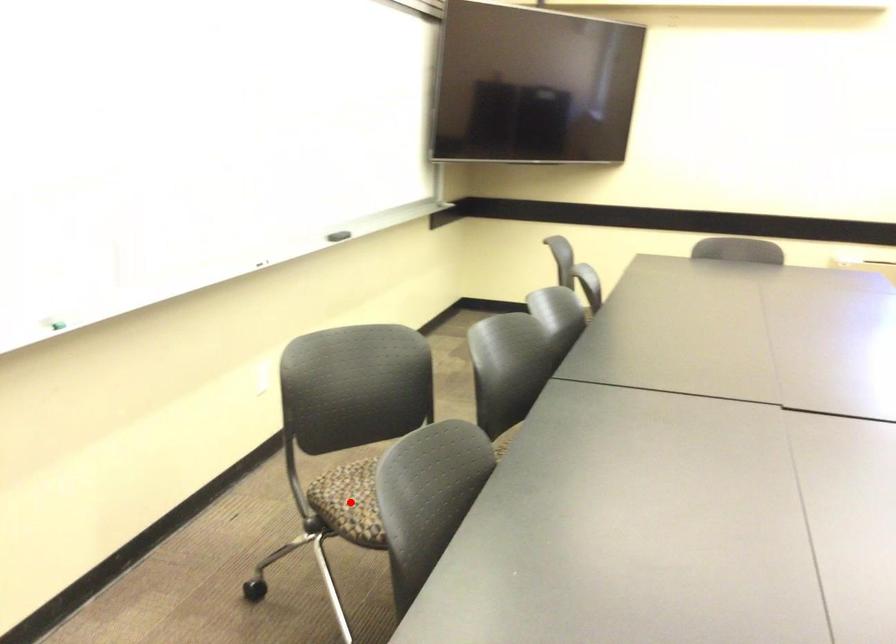
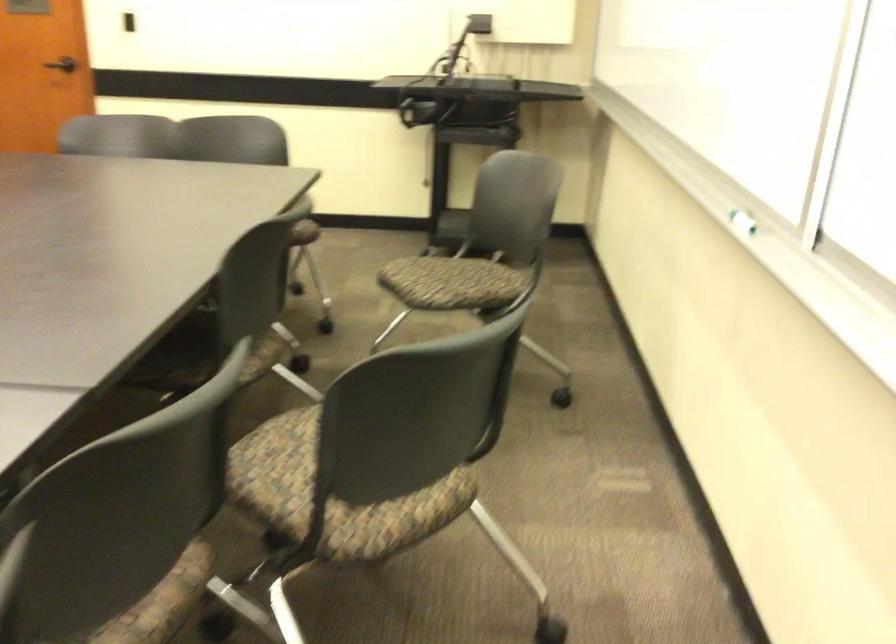
Question: I am providing you with two images of the same scene from different viewpoints. A red point is marked on the first image. Is the red point's position out of view in image 2?

Choices:
 (A) Yes
 (B) No

Answer: (A)